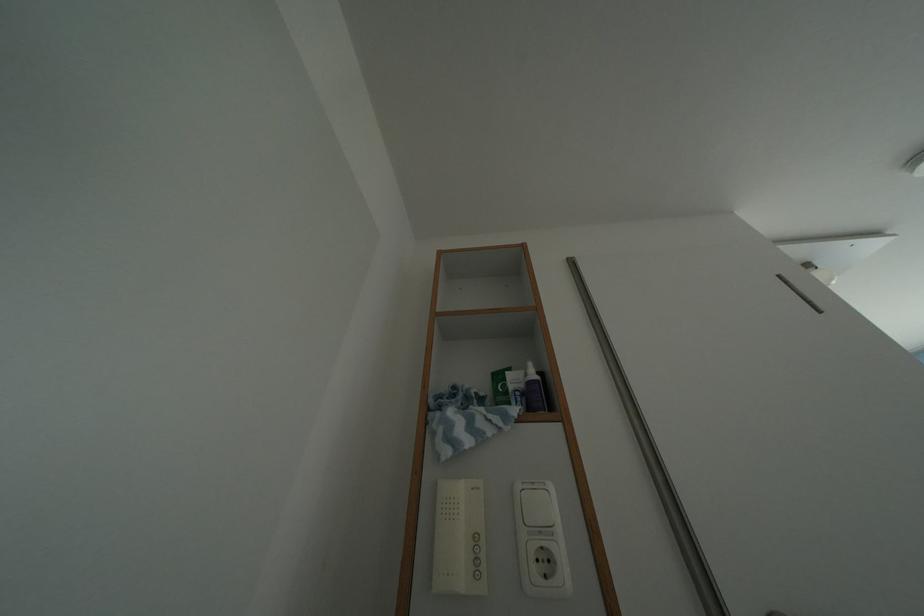
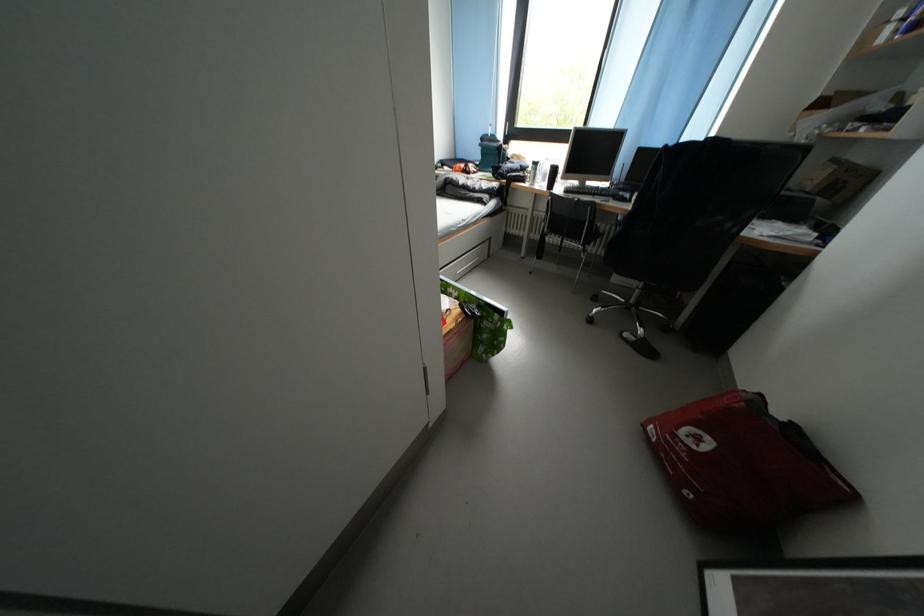
The first image is from the beginning of the video and the second image is from the end. How did the camera likely rotate when shooting the video?

The camera's rotation is toward right-down.